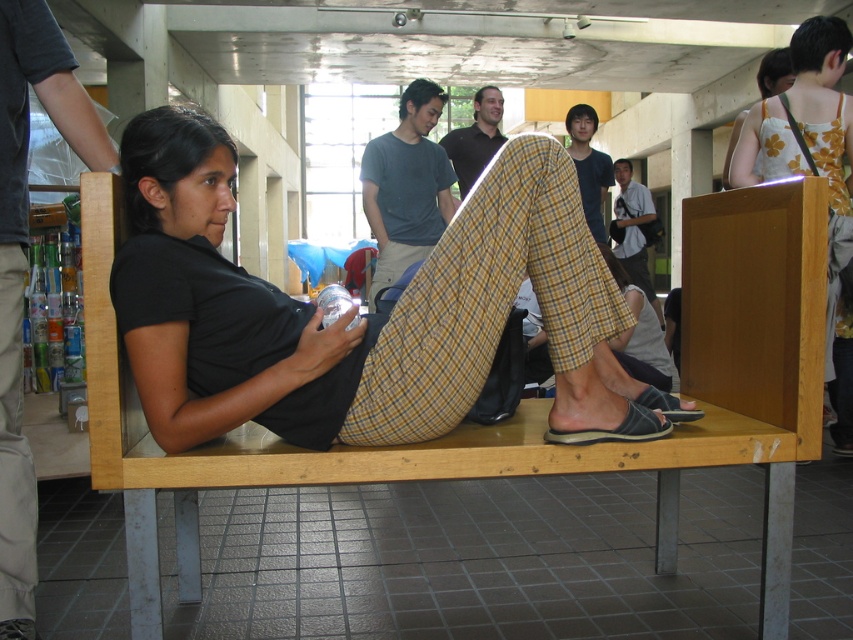
Can you confirm if khaki cotton pants at center is positioned to the right of light blue shirt at center?

Incorrect, khaki cotton pants at center is not on the right side of light blue shirt at center.

Can you confirm if khaki cotton pants at center is positioned below light blue shirt at center?

Yes.

Does point (16, 6) lie behind point (639, 182)?

No, it is in front of (639, 182).

Where is `khaki cotton pants at center`? The height and width of the screenshot is (640, 853). khaki cotton pants at center is located at coordinates (25, 268).

Which is more to the right, black cotton shirt at center or dark brown shirt at center?

dark brown shirt at center

Does point (229, 429) come in front of point (450, 141)?

Yes, it is in front of point (450, 141).

Locate an element on the screen. Image resolution: width=853 pixels, height=640 pixels. black cotton shirt at center is located at coordinates (351, 307).

Can you confirm if wooden bench at center is taller than black rubber sandal at lower center?

Indeed, wooden bench at center has a greater height compared to black rubber sandal at lower center.

Who is positioned more to the right, wooden bench at center or black rubber sandal at lower center?

black rubber sandal at lower center is more to the right.

Describe the element at coordinates (521, 401) in the screenshot. I see `wooden bench at center` at that location.

I want to click on wooden bench at center, so click(x=521, y=401).